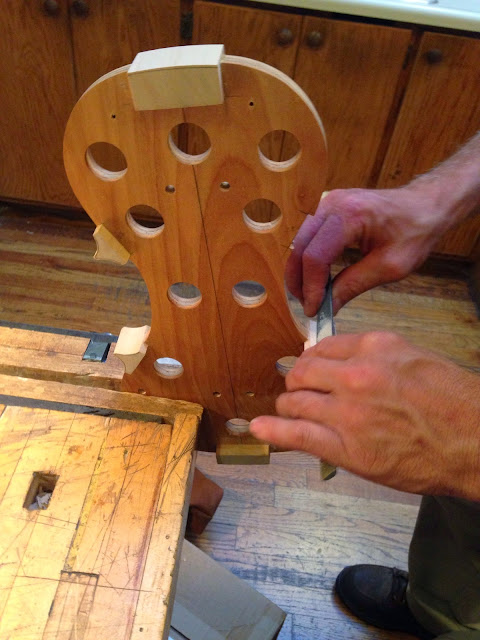
Where is `counter`? The width and height of the screenshot is (480, 640). counter is located at coordinates (442, 18).